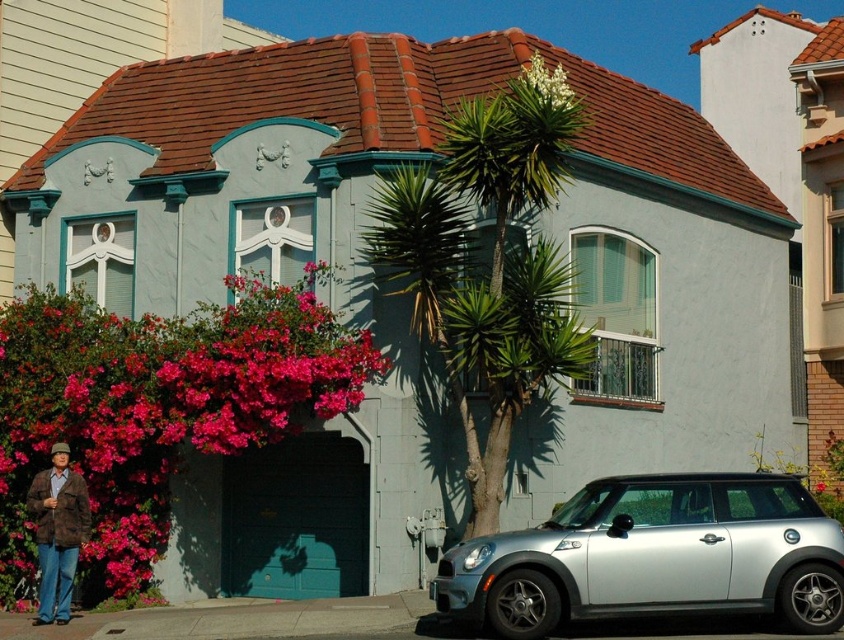
You are standing in front of the house and notice two points marked on the image. The first point is at coordinate point (788,579) and the second is at point (539,90). Which of these points is nearer to your current position?

Point (788,579) is closer to the camera than point (539,90), so the first point is nearer to your current position.